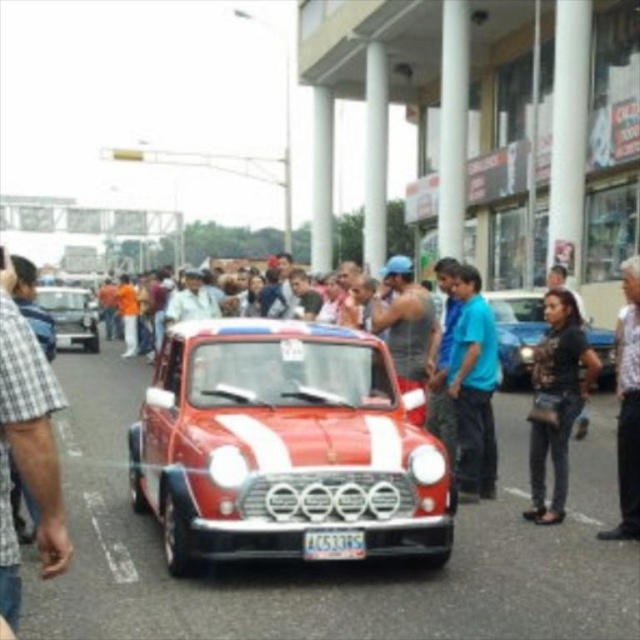
Looking at this image, does shiny black car at left appear over white plastic license plate at center?

Yes, shiny black car at left is above white plastic license plate at center.

Where is `shiny black car at left`? The width and height of the screenshot is (640, 640). shiny black car at left is located at coordinates (72, 316).

Where is `shiny black car at left`? The image size is (640, 640). shiny black car at left is located at coordinates (72, 316).

Can you confirm if shiny red car at center is thinner than camouflage fabric jacket at center?

No.

The height and width of the screenshot is (640, 640). What do you see at coordinates (282, 445) in the screenshot?
I see `shiny red car at center` at bounding box center [282, 445].

This screenshot has width=640, height=640. What are the coordinates of `shiny red car at center` in the screenshot? It's located at (282, 445).

Is blue cotton shirt at center shorter than shiny black car at left?

Indeed, blue cotton shirt at center has a lesser height compared to shiny black car at left.

Is blue cotton shirt at center bigger than shiny black car at left?

No, blue cotton shirt at center is not bigger than shiny black car at left.

In order to click on blue cotton shirt at center in this screenshot , I will do `click(474, 385)`.

Identify the location of blue cotton shirt at center. (474, 385).